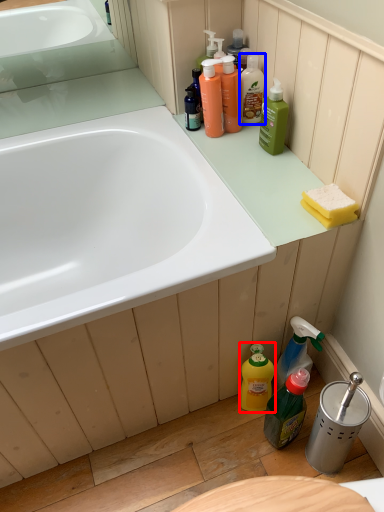
Question: Which object is further to the camera taking this photo, cleaning product (highlighted by a red box) or cleaning product (highlighted by a blue box)?

Choices:
 (A) cleaning product
 (B) cleaning product

Answer: (B)